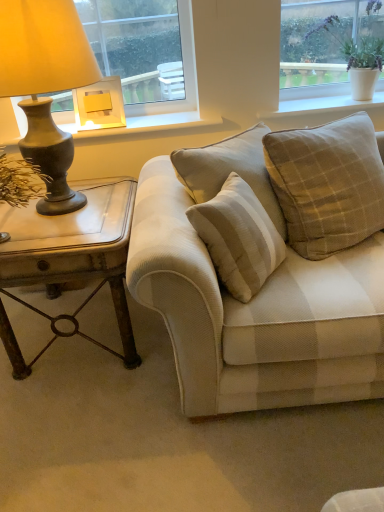
Question: Can you confirm if white ceramic pot at upper right, positioned as the 2th window in left-to-right order, is thinner than matte wood window sill at upper center?

Choices:
 (A) yes
 (B) no

Answer: (A)

Question: Can you confirm if white ceramic pot at upper right, which appears as the first window when viewed from the right, is shorter than matte wood window sill at upper center?

Choices:
 (A) no
 (B) yes

Answer: (A)

Question: Is white ceramic pot at upper right, which appears as the first window when viewed from the right, in front of matte wood window sill at upper center?

Choices:
 (A) yes
 (B) no

Answer: (A)

Question: Does white ceramic pot at upper right, which appears as the first window when viewed from the right, have a larger size compared to matte wood window sill at upper center?

Choices:
 (A) yes
 (B) no

Answer: (A)

Question: Considering the relative sizes of white ceramic pot at upper right, positioned as the 2th window in left-to-right order, and matte wood window sill at upper center in the image provided, is white ceramic pot at upper right, positioned as the 2th window in left-to-right order, taller than matte wood window sill at upper center?

Choices:
 (A) yes
 (B) no

Answer: (A)

Question: From a real-world perspective, is matte bronze lamp at left, marked as the 1th lamp in a front-to-back arrangement, above or below beige textured couch at center?

Choices:
 (A) above
 (B) below

Answer: (A)

Question: Is matte bronze lamp at left, positioned as the 2th lamp in back-to-front order, bigger or smaller than beige textured couch at center?

Choices:
 (A) big
 (B) small

Answer: (B)

Question: Considering the positions of matte bronze lamp at left, positioned as the 2th lamp in back-to-front order, and beige textured couch at center in the image, is matte bronze lamp at left, positioned as the 2th lamp in back-to-front order, wider or thinner than beige textured couch at center?

Choices:
 (A) thin
 (B) wide

Answer: (A)

Question: From the image's perspective, relative to beige textured couch at center, is matte bronze lamp at left, marked as the 1th lamp in a front-to-back arrangement, above or below?

Choices:
 (A) below
 (B) above

Answer: (B)

Question: Is matte gold lampshade at upper left, the first lamp viewed from the back, spatially inside matte wood window sill at upper center, or outside of it?

Choices:
 (A) outside
 (B) inside

Answer: (A)

Question: From the image's perspective, relative to matte wood window sill at upper center, is matte gold lampshade at upper left, which is the 2th lamp in front-to-back order, above or below?

Choices:
 (A) above
 (B) below

Answer: (A)

Question: From their relative heights in the image, would you say matte gold lampshade at upper left, the first lamp viewed from the back, is taller or shorter than matte wood window sill at upper center?

Choices:
 (A) short
 (B) tall

Answer: (B)

Question: Is point (105, 87) positioned closer to the camera than point (206, 130)?

Choices:
 (A) farther
 (B) closer

Answer: (B)

Question: Is white ceramic pot at upper right, which appears as the first window when viewed from the right, in front of or behind matte bronze lamp at left, positioned as the 2th lamp in back-to-front order, in the image?

Choices:
 (A) front
 (B) behind

Answer: (B)

Question: Is point (309, 16) closer or farther from the camera than point (57, 77)?

Choices:
 (A) farther
 (B) closer

Answer: (A)